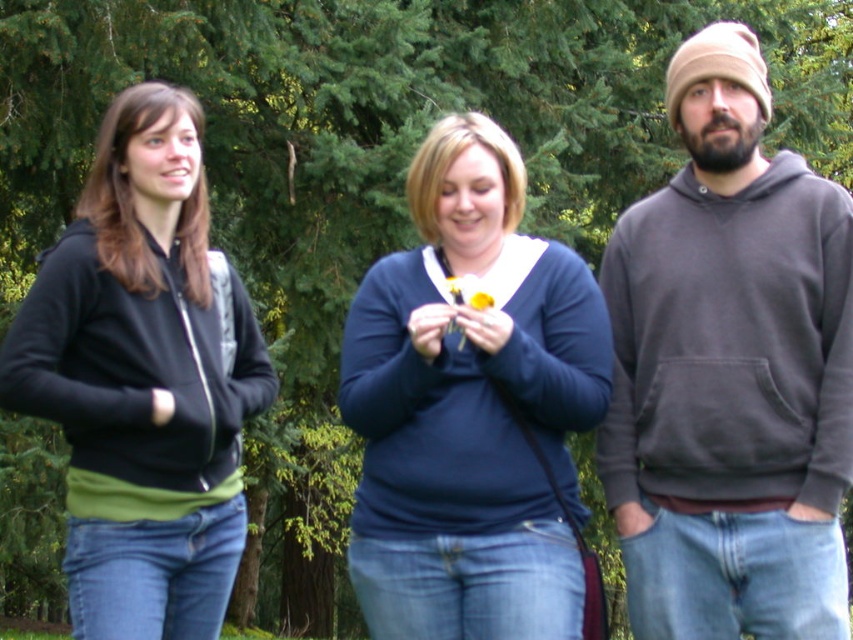
Question: Which of the following is the closest to the observer?

Choices:
 (A) (225, 500)
 (B) (482, 301)
 (C) (643, 202)
 (D) (363, 465)

Answer: (B)

Question: Which of these objects is positioned closest to the black matte hoodie at left?

Choices:
 (A) gray hoodie at right
 (B) blue matte sweater at center

Answer: (B)

Question: Can you confirm if blue matte sweater at center is positioned to the left of black matte hoodie at left?

Choices:
 (A) no
 (B) yes

Answer: (A)

Question: Which point is farther to the camera?

Choices:
 (A) black matte hoodie at left
 (B) yellow matte flower at center

Answer: (B)

Question: Does gray hoodie at right have a smaller size compared to yellow matte flower at center?

Choices:
 (A) no
 (B) yes

Answer: (A)

Question: Does blue matte sweater at center come behind black matte hoodie at left?

Choices:
 (A) no
 (B) yes

Answer: (B)